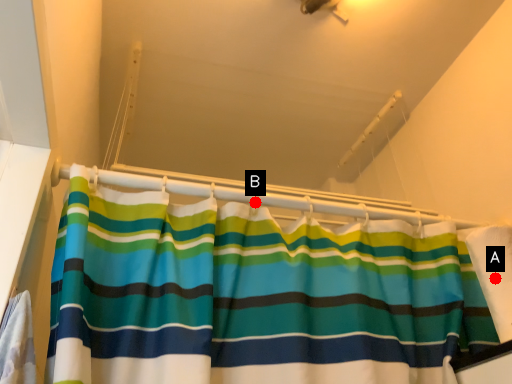
Question: Two points are circled on the image, labeled by A and B beside each circle. Which point is farther to the camera?

Choices:
 (A) A is further
 (B) B is further

Answer: (B)